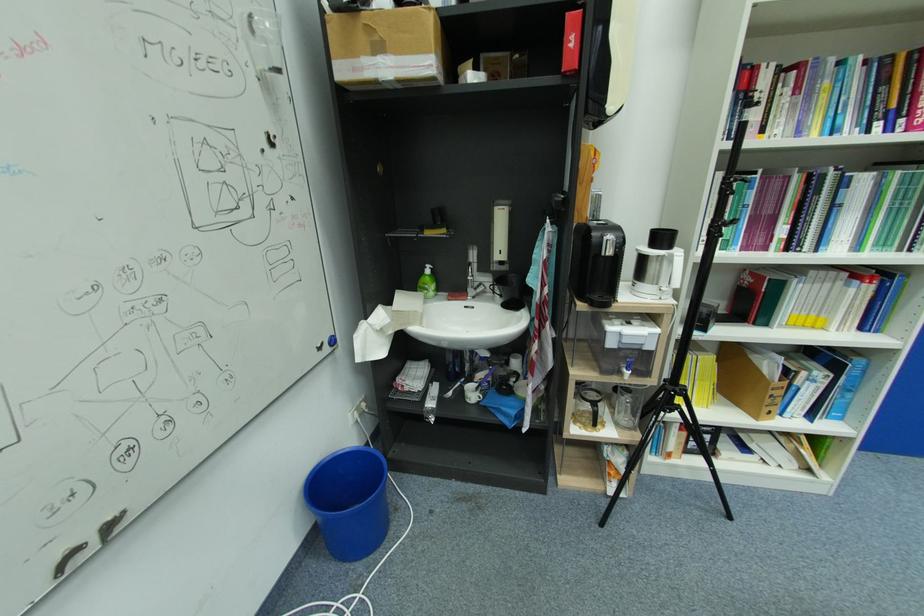
The height and width of the screenshot is (616, 924). Find the location of `blue spray bottle trigger`. blue spray bottle trigger is located at coordinates (332, 341).